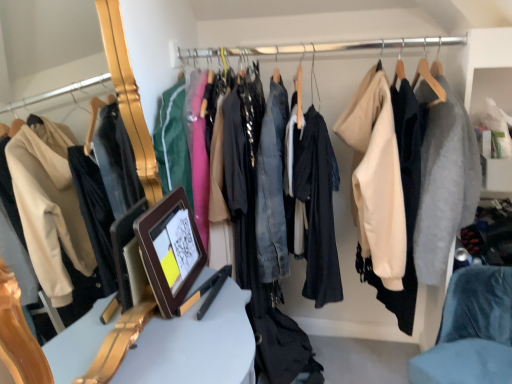
The image size is (512, 384). Find the location of `velvet blue chair at lower right`. velvet blue chair at lower right is located at coordinates (471, 331).

This screenshot has width=512, height=384. What do you see at coordinates (195, 345) in the screenshot? I see `white glossy table at center` at bounding box center [195, 345].

The width and height of the screenshot is (512, 384). Identify the location of velvet blue chair at lower right. (471, 331).

From a real-world perspective, is velvet blue chair at lower right physically above white glossy table at center?

No, from a real-world perspective, velvet blue chair at lower right is not above white glossy table at center.

Considering the sizes of objects velvet blue chair at lower right and white glossy table at center in the image provided, who is bigger, velvet blue chair at lower right or white glossy table at center?

Bigger between the two is white glossy table at center.

Which object is closer to the camera taking this photo, velvet blue chair at lower right or white glossy table at center?

white glossy table at center is closer to the camera.

How many degrees apart are the facing directions of velvet blue chair at lower right and white glossy table at center?

The facing directions of velvet blue chair at lower right and white glossy table at center are 140 degrees apart.

Which is more to the right, brown wooden picture frame at center or white glossy table at center?

white glossy table at center.

Which is closer, (x=168, y=211) or (x=197, y=305)?

Point (x=168, y=211).

Based on the photo, is brown wooden picture frame at center positioned beyond the bounds of white glossy table at center?

Yes, brown wooden picture frame at center is outside of white glossy table at center.

Is brown wooden picture frame at center turned away from white glossy table at center?

No, brown wooden picture frame at center is not facing away from white glossy table at center.

Is white glossy table at center placed right next to brown wooden picture frame at center?

No, white glossy table at center is not touching brown wooden picture frame at center.

Looking at this image, is white glossy table at center turned away from brown wooden picture frame at center?

No, brown wooden picture frame at center is not at the back of white glossy table at center.

From a real-world perspective, does white glossy table at center sit lower than brown wooden picture frame at center?

Yes, from a real-world perspective, white glossy table at center is under brown wooden picture frame at center.

Can you confirm if velvet blue chair at lower right is wider than brown wooden picture frame at center?

Yes, velvet blue chair at lower right is wider than brown wooden picture frame at center.

Is velvet blue chair at lower right outside of brown wooden picture frame at center?

That's correct, velvet blue chair at lower right is outside of brown wooden picture frame at center.

Is velvet blue chair at lower right taller than brown wooden picture frame at center?

Indeed, velvet blue chair at lower right has a greater height compared to brown wooden picture frame at center.

In terms of size, does velvet blue chair at lower right appear bigger or smaller than brown wooden picture frame at center?

In the image, velvet blue chair at lower right appears to be larger than brown wooden picture frame at center.

Can you confirm if white glossy table at center is positioned to the right of velvet blue chair at lower right?

No, white glossy table at center is not to the right of velvet blue chair at lower right.

At what (x,y) coordinates should I click in order to perform the action: click on furniture lying in front of the velvet blue chair at lower right. Please return your answer as a coordinate pair (x, y). Looking at the image, I should click on (195, 345).

Consider the image. Is white glossy table at center further to the viewer compared to velvet blue chair at lower right?

No, the depth of white glossy table at center is less than that of velvet blue chair at lower right.

Does brown wooden picture frame at center have a lesser height compared to velvet blue chair at lower right?

Correct, brown wooden picture frame at center is not as tall as velvet blue chair at lower right.

Is brown wooden picture frame at center with velvet blue chair at lower right?

No, brown wooden picture frame at center is not next to velvet blue chair at lower right.

From a real-world perspective, which is physically below, brown wooden picture frame at center or velvet blue chair at lower right?

velvet blue chair at lower right.

Which is closer to the camera, [193,241] or [480,332]?

Point [193,241] appears to be closer to the viewer than point [480,332].

This screenshot has height=384, width=512. I want to click on chair below the white glossy table at center (from a real-world perspective), so click(x=471, y=331).

At what (x,y) coordinates should I click in order to perform the action: click on furniture below the brown wooden picture frame at center (from the image's perspective). Please return your answer as a coordinate pair (x, y). The image size is (512, 384). Looking at the image, I should click on (195, 345).

When comparing their distances from white glossy table at center, does velvet blue chair at lower right or brown wooden picture frame at center seem further?

velvet blue chair at lower right lies further to white glossy table at center than the other object.

Considering their positions, is velvet blue chair at lower right positioned closer to brown wooden picture frame at center than white glossy table at center?

Among the two, white glossy table at center is located nearer to brown wooden picture frame at center.

Looking at the image, which one is located further to velvet blue chair at lower right, brown wooden picture frame at center or white glossy table at center?

brown wooden picture frame at center is further to velvet blue chair at lower right.

Which object lies nearer to the anchor point white glossy table at center, brown wooden picture frame at center or velvet blue chair at lower right?

Among the two, brown wooden picture frame at center is located nearer to white glossy table at center.

Estimate the real-world distances between objects in this image. Which object is further from brown wooden picture frame at center, white glossy table at center or velvet blue chair at lower right?

The object further to brown wooden picture frame at center is velvet blue chair at lower right.

Based on their spatial positions, is white glossy table at center or brown wooden picture frame at center further from velvet blue chair at lower right?

Among the two, brown wooden picture frame at center is located further to velvet blue chair at lower right.

Find the location of a particular element. The height and width of the screenshot is (384, 512). furniture between brown wooden picture frame at center and velvet blue chair at lower right is located at coordinates (x=195, y=345).